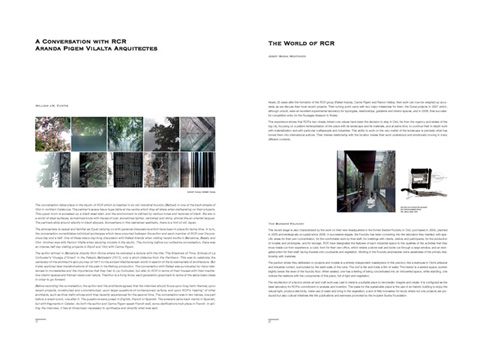
The image size is (500, 353). Find the location of `black and white picture`. black and white picture is located at coordinates (420, 175).